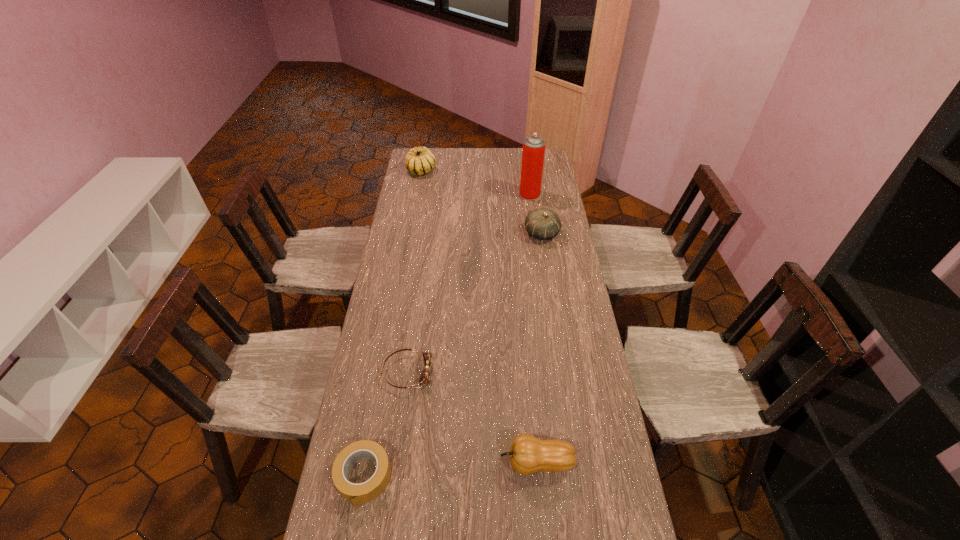
Image resolution: width=960 pixels, height=540 pixels. I want to click on aerosol can at the right edge, so click(533, 152).

At what (x,y) coordinates should I click in order to perform the action: click on object that is positioned at the far left corner. Please return your answer as a coordinate pair (x, y). This screenshot has height=540, width=960. Looking at the image, I should click on (419, 160).

The width and height of the screenshot is (960, 540). What are the coordinates of `free space at the far edge` in the screenshot? It's located at (505, 156).

In the image, there is a desktop. Find the location of `vacant region at the left edge`. vacant region at the left edge is located at coordinates (378, 312).

Image resolution: width=960 pixels, height=540 pixels. What are the coordinates of `vacant space at the right edge of the desktop` in the screenshot? It's located at (597, 390).

This screenshot has height=540, width=960. Find the location of `free space at the far left corner of the desktop`. free space at the far left corner of the desktop is located at coordinates (433, 150).

Locate an element on the screen. free space between the goggles and the second farthest object is located at coordinates (468, 284).

The height and width of the screenshot is (540, 960). In order to click on blank region between the nearest gourd and the leftmost gourd in this screenshot , I will do `click(479, 316)`.

Image resolution: width=960 pixels, height=540 pixels. I want to click on empty space that is in between the nearest gourd and the duct tape, so click(450, 470).

Locate an element on the screen. unoccupied position between the aerosol can and the duct tape is located at coordinates (446, 336).